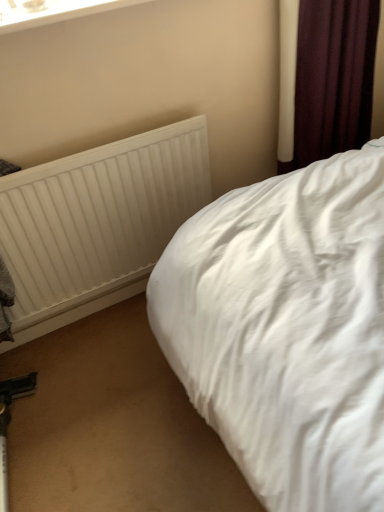
Question: Is dark purple fabric at upper right bigger or smaller than white textured radiator at upper left?

Choices:
 (A) small
 (B) big

Answer: (B)

Question: From the image's perspective, is dark purple fabric at upper right above or below white textured radiator at upper left?

Choices:
 (A) above
 (B) below

Answer: (A)

Question: Which of these objects is positioned closest to the white textured radiator at upper left?

Choices:
 (A) white cotton bed at center
 (B) dark purple fabric at upper right
 (C) white plastic window frame at upper left

Answer: (A)

Question: Which is nearer to the white textured radiator at upper left?

Choices:
 (A) dark purple fabric at upper right
 (B) white plastic window frame at upper left
 (C) white cotton bed at center

Answer: (C)